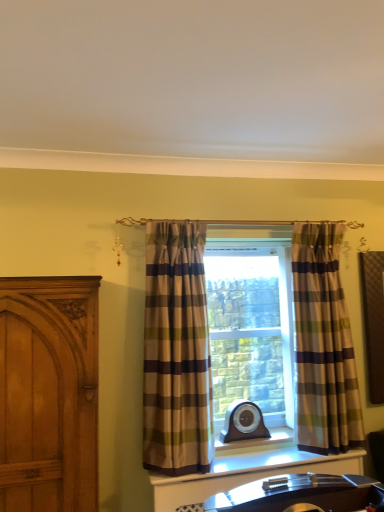
Question: In which direction should I rotate to look at plaid fabric curtain at center, the second curtain from the right?

Choices:
 (A) left
 (B) right

Answer: (A)

Question: Considering the relative sizes of plaid fabric curtain at center, placed as the 2th curtain when sorted from left to right, and plaid fabric curtain at center, the first curtain positioned from the left, in the image provided, is plaid fabric curtain at center, placed as the 2th curtain when sorted from left to right, wider than plaid fabric curtain at center, the first curtain positioned from the left,?

Choices:
 (A) no
 (B) yes

Answer: (A)

Question: Is plaid fabric curtain at center, placed as the 2th curtain when sorted from left to right, next to plaid fabric curtain at center, the second curtain from the right?

Choices:
 (A) no
 (B) yes

Answer: (A)

Question: From the image's perspective, is plaid fabric curtain at center, placed as the 2th curtain when sorted from left to right, located above plaid fabric curtain at center, the first curtain positioned from the left?

Choices:
 (A) yes
 (B) no

Answer: (B)

Question: Considering the relative positions of plaid fabric curtain at center, placed as the 2th curtain when sorted from left to right, and plaid fabric curtain at center, the second curtain from the right, in the image provided, is plaid fabric curtain at center, placed as the 2th curtain when sorted from left to right, to the right of plaid fabric curtain at center, the second curtain from the right, from the viewer's perspective?

Choices:
 (A) yes
 (B) no

Answer: (A)

Question: From the image's perspective, does plaid fabric curtain at center, which ranks as the first curtain in right-to-left order, appear lower than plaid fabric curtain at center, the first curtain positioned from the left?

Choices:
 (A) yes
 (B) no

Answer: (A)

Question: Is plaid fabric curtain at center, placed as the 2th curtain when sorted from left to right, shorter than plaid fabric curtain at center, the second curtain from the right?

Choices:
 (A) yes
 (B) no

Answer: (A)

Question: Considering the relative sizes of plaid fabric curtain at center, the first curtain positioned from the left, and plaid fabric curtain at center, which ranks as the first curtain in right-to-left order, in the image provided, is plaid fabric curtain at center, the first curtain positioned from the left, taller than plaid fabric curtain at center, which ranks as the first curtain in right-to-left order,?

Choices:
 (A) no
 (B) yes

Answer: (B)

Question: Is plaid fabric curtain at center, the first curtain positioned from the left, oriented away from plaid fabric curtain at center, placed as the 2th curtain when sorted from left to right?

Choices:
 (A) yes
 (B) no

Answer: (B)

Question: Is plaid fabric curtain at center, the second curtain from the right, at the left side of plaid fabric curtain at center, placed as the 2th curtain when sorted from left to right?

Choices:
 (A) no
 (B) yes

Answer: (B)

Question: Could plaid fabric curtain at center, which ranks as the first curtain in right-to-left order, be considered to be inside plaid fabric curtain at center, the second curtain from the right?

Choices:
 (A) yes
 (B) no

Answer: (B)

Question: From the image's perspective, does plaid fabric curtain at center, the first curtain positioned from the left, appear higher than plaid fabric curtain at center, which ranks as the first curtain in right-to-left order?

Choices:
 (A) yes
 (B) no

Answer: (A)

Question: Is plaid fabric curtain at center, the second curtain from the right, next to plaid fabric curtain at center, which ranks as the first curtain in right-to-left order?

Choices:
 (A) yes
 (B) no

Answer: (B)

Question: Can you confirm if plaid fabric curtain at center, the second curtain from the right, is positioned to the right of wooden carved door at left?

Choices:
 (A) yes
 (B) no

Answer: (A)